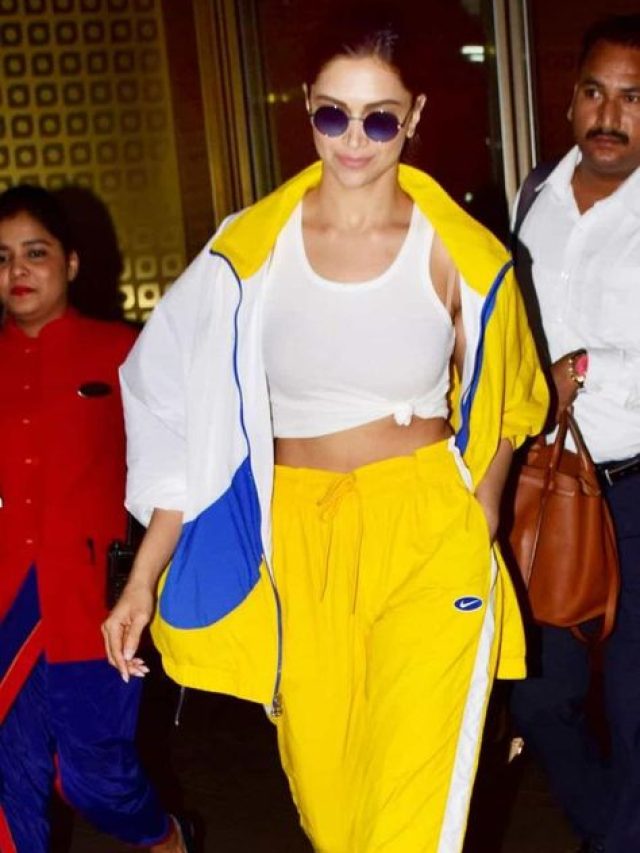
Where is `handle`? Image resolution: width=640 pixels, height=853 pixels. handle is located at coordinates (509, 117), (527, 30).